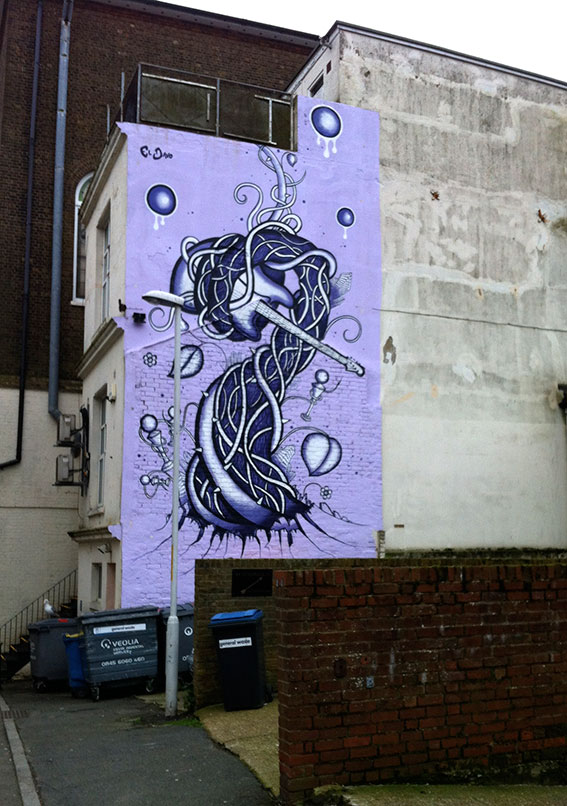
Locate an element on the screen. This screenshot has width=567, height=806. floor is located at coordinates (259, 736), (409, 794), (156, 696).